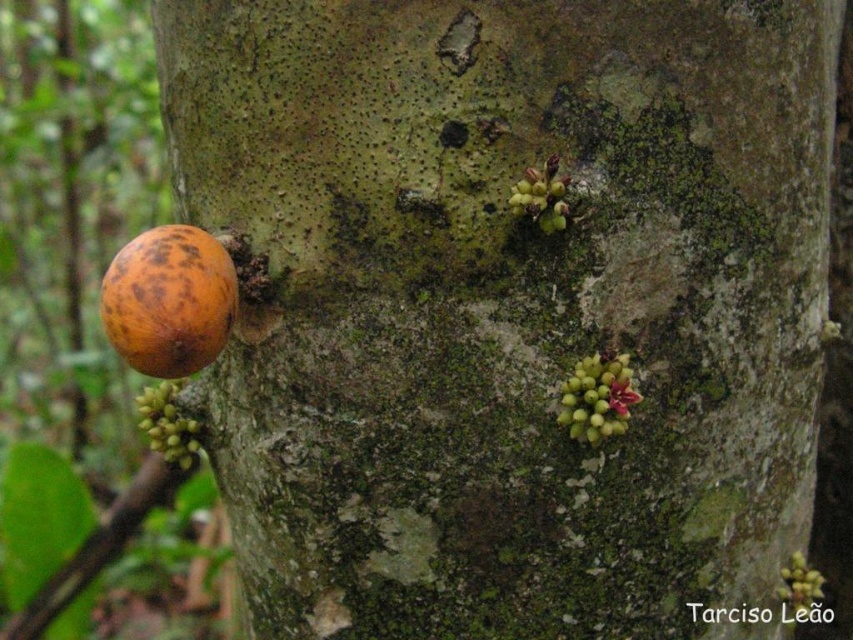
Question: Can you confirm if rotten orange fruit at left is wider than green matte cluster at upper right?

Choices:
 (A) no
 (B) yes

Answer: (B)

Question: Is rotten orange fruit at left further to camera compared to green matte cluster at upper center?

Choices:
 (A) yes
 (B) no

Answer: (B)

Question: Which point is closer to the camera?

Choices:
 (A) (171, 292)
 (B) (543, 208)

Answer: (A)

Question: Which of the following is the farthest from the observer?

Choices:
 (A) green matte cluster at upper right
 (B) rotten orange fruit at left

Answer: (A)

Question: Considering the real-world distances, which object is farthest from the green matte cluster at upper right?

Choices:
 (A) rotten orange fruit at left
 (B) green matte cluster at upper center

Answer: (A)

Question: Does green matte cluster at upper right appear over green matte cluster at upper center?

Choices:
 (A) yes
 (B) no

Answer: (B)